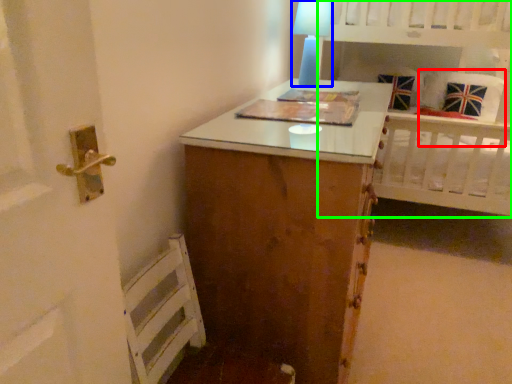
Question: Which object is positioned farthest from pillow (highlighted by a red box)? Select from table lamp (highlighted by a blue box) and bed (highlighted by a green box).

Choices:
 (A) table lamp
 (B) bed

Answer: (A)